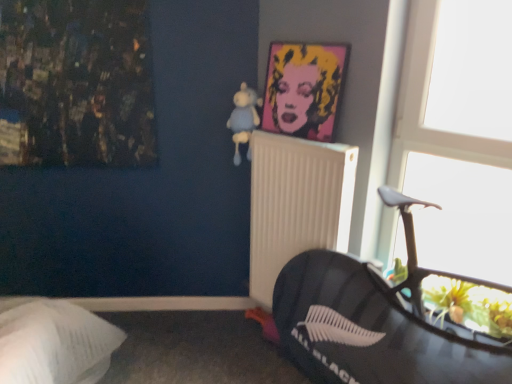
Question: Is light blue plush at upper center wider or thinner than white plastic radiator at center?

Choices:
 (A) thin
 (B) wide

Answer: (B)

Question: Based on their positions, is light blue plush at upper center located to the left or right of white plastic radiator at center?

Choices:
 (A) right
 (B) left

Answer: (B)

Question: Which object is the farthest from the pop art portrait at upper center?

Choices:
 (A) light blue plush at upper center
 (B) white plastic radiator at center

Answer: (B)

Question: Which of these objects is positioned closest to the pop art portrait at upper center?

Choices:
 (A) light blue plush at upper center
 (B) white plastic radiator at center

Answer: (A)